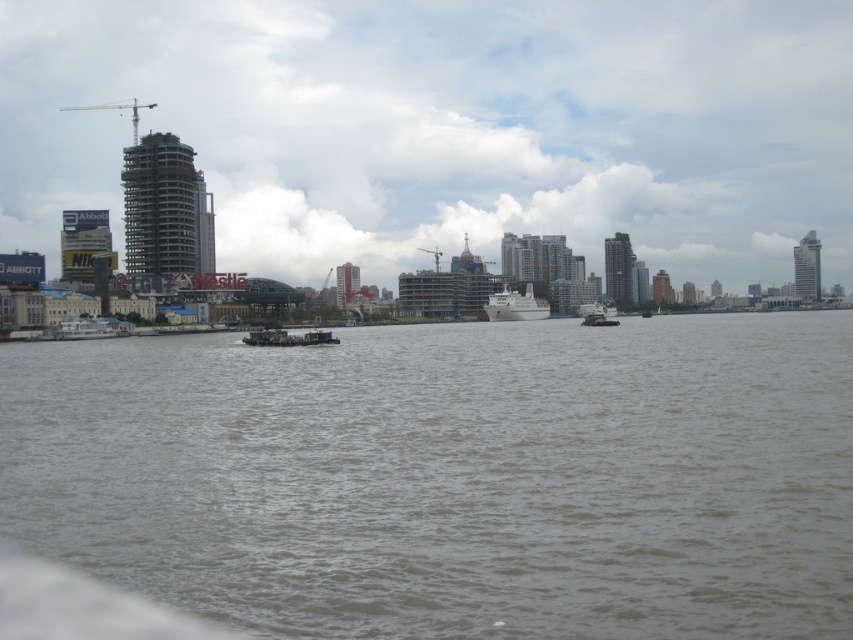
Is white glossy ship at center shorter than white matte boat at center?

In fact, white glossy ship at center may be taller than white matte boat at center.

Find the location of a particular element. white glossy ship at center is located at coordinates pyautogui.click(x=515, y=305).

Where is `white glossy ship at center`? The height and width of the screenshot is (640, 853). white glossy ship at center is located at coordinates (515, 305).

Does gray water at center have a lesser height compared to white matte barge at left?

No.

This screenshot has height=640, width=853. What do you see at coordinates (451, 476) in the screenshot?
I see `gray water at center` at bounding box center [451, 476].

The image size is (853, 640). I want to click on gray water at center, so click(451, 476).

Can you confirm if gray water at center is positioned to the right of metallic gray barge at center?

Correct, you'll find gray water at center to the right of metallic gray barge at center.

Who is more forward, (726, 632) or (279, 339)?

Positioned in front is point (726, 632).

You are a GUI agent. You are given a task and a screenshot of the screen. Output one action in this format:
    pyautogui.click(x=<x>, y=<y>)
    Task: Click on the gray water at center
    
    Given the screenshot: What is the action you would take?
    pyautogui.click(x=451, y=476)